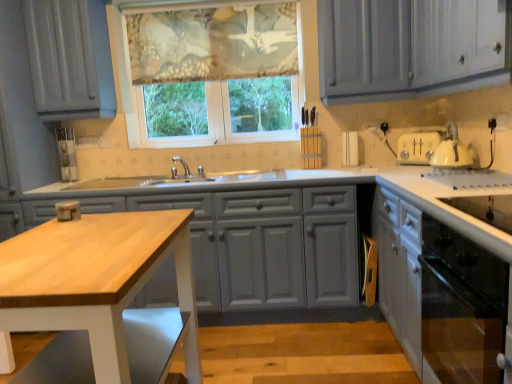
From the picture: What is the approximate width of wooden table at center?

wooden table at center is 20.93 inches in width.

The height and width of the screenshot is (384, 512). Find the location of `matte gray cabinets at center, the second cabinetry in the right-to-left sequence`. matte gray cabinets at center, the second cabinetry in the right-to-left sequence is located at coordinates (264, 245).

Is textured floral fabric at upper center oriented towards matte gray cabinets at center, marked as the first cabinetry in a left-to-right arrangement?

No, textured floral fabric at upper center does not turn towards matte gray cabinets at center, marked as the first cabinetry in a left-to-right arrangement.

Considering the positions of points (289, 16) and (236, 226), is point (289, 16) farther from camera compared to point (236, 226)?

Yes, point (289, 16) is behind point (236, 226).

Is textured floral fabric at upper center far away from matte gray cabinets at center, marked as the first cabinetry in a left-to-right arrangement?

Indeed, textured floral fabric at upper center is not near matte gray cabinets at center, marked as the first cabinetry in a left-to-right arrangement.

From a real-world perspective, is textured floral fabric at upper center below matte gray cabinets at center, the second cabinetry in the right-to-left sequence?

Incorrect, from a real-world perspective, textured floral fabric at upper center is higher than matte gray cabinets at center, the second cabinetry in the right-to-left sequence.

From the picture: Is wooden table at center further to camera compared to translucent floral fabric at center?

No, the depth of wooden table at center is less than that of translucent floral fabric at center.

Identify the location of window located above the wooden table at center (from a real-world perspective). (214, 73).

Is wooden table at center positioned with its back to translucent floral fabric at center?

No.

Can you tell me how much wooden table at center and translucent floral fabric at center differ in facing direction?

90.7 degrees separate the facing orientations of wooden table at center and translucent floral fabric at center.

Is point (460, 368) in front of point (134, 147)?

Yes, point (460, 368) is closer to viewer.

Considering the relative sizes of white glossy cabinet at lower right, which is the first cabinetry in right-to-left order, and translucent floral fabric at center in the image provided, is white glossy cabinet at lower right, which is the first cabinetry in right-to-left order, smaller than translucent floral fabric at center?

No, white glossy cabinet at lower right, which is the first cabinetry in right-to-left order, is not smaller than translucent floral fabric at center.

Is white glossy cabinet at lower right, which appears as the 2th cabinetry when viewed from the left, taller or shorter than translucent floral fabric at center?

Clearly, white glossy cabinet at lower right, which appears as the 2th cabinetry when viewed from the left, is shorter compared to translucent floral fabric at center.

From the image's perspective, which one is positioned lower, white glossy cabinet at lower right, which is the first cabinetry in right-to-left order, or translucent floral fabric at center?

white glossy cabinet at lower right, which is the first cabinetry in right-to-left order, from the image's perspective.

Considering the sizes of objects translucent floral fabric at center and matte gray cabinets at center, the second cabinetry in the right-to-left sequence, in the image provided, who is smaller, translucent floral fabric at center or matte gray cabinets at center, the second cabinetry in the right-to-left sequence,?

Smaller between the two is translucent floral fabric at center.

Is point (284, 77) closer or farther from the camera than point (260, 291)?

Clearly, point (284, 77) is more distant from the camera than point (260, 291).

In the scene shown: Considering the sizes of objects translucent floral fabric at center and matte gray cabinets at center, the second cabinetry in the right-to-left sequence, in the image provided, who is thinner, translucent floral fabric at center or matte gray cabinets at center, the second cabinetry in the right-to-left sequence,?

translucent floral fabric at center is thinner.

Is matte gray cabinets at center, the second cabinetry in the right-to-left sequence, facing towards textured floral fabric at upper center?

No, matte gray cabinets at center, the second cabinetry in the right-to-left sequence, is not turned towards textured floral fabric at upper center.

From a real-world perspective, is matte gray cabinets at center, the second cabinetry in the right-to-left sequence, positioned above or below textured floral fabric at upper center?

matte gray cabinets at center, the second cabinetry in the right-to-left sequence, is below textured floral fabric at upper center.

Which of these two, matte gray cabinets at center, marked as the first cabinetry in a left-to-right arrangement, or textured floral fabric at upper center, is smaller?

Smaller between the two is textured floral fabric at upper center.

How different are the orientations of matte gray cabinets at center, the second cabinetry in the right-to-left sequence, and textured floral fabric at upper center in degrees?

The facing directions of matte gray cabinets at center, the second cabinetry in the right-to-left sequence, and textured floral fabric at upper center are 0.00907 degrees apart.

From a real-world perspective, which is physically above, wooden table at center or matte gray cabinets at center, marked as the first cabinetry in a left-to-right arrangement?

wooden table at center.

Is wooden table at center next to matte gray cabinets at center, the second cabinetry in the right-to-left sequence?

wooden table at center and matte gray cabinets at center, the second cabinetry in the right-to-left sequence, are clearly separated.

Considering the relative sizes of wooden table at center and matte gray cabinets at center, the second cabinetry in the right-to-left sequence, in the image provided, is wooden table at center bigger than matte gray cabinets at center, the second cabinetry in the right-to-left sequence,?

No, wooden table at center is not bigger than matte gray cabinets at center, the second cabinetry in the right-to-left sequence.

Between wooden table at center and matte gray cabinets at center, marked as the first cabinetry in a left-to-right arrangement, which one has less height?

A: Standing shorter between the two is wooden table at center.

From the picture: Does textured floral fabric at upper center contain translucent floral fabric at center?

Yes, textured floral fabric at upper center contains translucent floral fabric at center.

From a real-world perspective, which is physically above, textured floral fabric at upper center or translucent floral fabric at center?

From a 3D spatial view, textured floral fabric at upper center is above.

Which object is positioned more to the left, textured floral fabric at upper center or translucent floral fabric at center?

Positioned to the left is textured floral fabric at upper center.

Where is `curtain in front of the translucent floral fabric at center`? The width and height of the screenshot is (512, 384). curtain in front of the translucent floral fabric at center is located at coordinates (213, 43).

Locate an element on the screen. This screenshot has width=512, height=384. the 1st cabinetry in front of the textured floral fabric at upper center, counting from the anchor's position is located at coordinates (264, 245).

Locate an element on the screen. window above the wooden table at center (from a real-world perspective) is located at coordinates (214, 73).

Which object lies nearer to the anchor point wooden table at center, white glossy cabinet at lower right, which is the first cabinetry in right-to-left order, or translucent floral fabric at center?

white glossy cabinet at lower right, which is the first cabinetry in right-to-left order.

Based on their spatial positions, is white glossy cabinet at lower right, which is the first cabinetry in right-to-left order, or textured floral fabric at upper center further from matte gray cabinets at center, marked as the first cabinetry in a left-to-right arrangement?

textured floral fabric at upper center is positioned further to the anchor matte gray cabinets at center, marked as the first cabinetry in a left-to-right arrangement.

Estimate the real-world distances between objects in this image. Which object is further from textured floral fabric at upper center, matte gray cabinets at center, marked as the first cabinetry in a left-to-right arrangement, or translucent floral fabric at center?

matte gray cabinets at center, marked as the first cabinetry in a left-to-right arrangement.

Which object lies further to the anchor point white glossy cabinet at lower right, which appears as the 2th cabinetry when viewed from the left, matte gray cabinets at center, the second cabinetry in the right-to-left sequence, or textured floral fabric at upper center?

The object further to white glossy cabinet at lower right, which appears as the 2th cabinetry when viewed from the left, is textured floral fabric at upper center.

Based on their spatial positions, is wooden table at center or translucent floral fabric at center further from white glossy cabinet at lower right, which is the first cabinetry in right-to-left order?

translucent floral fabric at center is further to white glossy cabinet at lower right, which is the first cabinetry in right-to-left order.

From the image, which object appears to be nearer to translucent floral fabric at center, white glossy cabinet at lower right, which is the first cabinetry in right-to-left order, or textured floral fabric at upper center?

Among the two, textured floral fabric at upper center is located nearer to translucent floral fabric at center.

Which object lies further to the anchor point textured floral fabric at upper center, wooden table at center or matte gray cabinets at center, the second cabinetry in the right-to-left sequence?

Based on the image, wooden table at center appears to be further to textured floral fabric at upper center.

Considering their positions, is white glossy cabinet at lower right, which is the first cabinetry in right-to-left order, positioned closer to translucent floral fabric at center than wooden table at center?

white glossy cabinet at lower right, which is the first cabinetry in right-to-left order, lies closer to translucent floral fabric at center than the other object.

Locate an element on the screen. cabinetry between wooden table at center and white glossy cabinet at lower right, which is the first cabinetry in right-to-left order, from left to right is located at coordinates (264, 245).

The width and height of the screenshot is (512, 384). I want to click on cabinetry between white glossy cabinet at lower right, which is the first cabinetry in right-to-left order, and textured floral fabric at upper center, along the z-axis, so click(x=264, y=245).

Locate an element on the screen. This screenshot has width=512, height=384. window that lies between textured floral fabric at upper center and matte gray cabinets at center, marked as the first cabinetry in a left-to-right arrangement, from top to bottom is located at coordinates (214, 73).

Locate an element on the screen. curtain positioned between wooden table at center and translucent floral fabric at center from near to far is located at coordinates (213, 43).